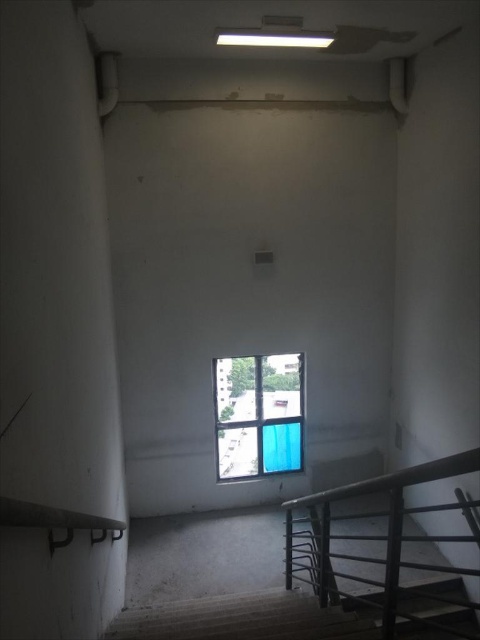
Question: Can you confirm if metallic gray balustrade at lower right is bigger than blue fabric curtain at center?

Choices:
 (A) yes
 (B) no

Answer: (A)

Question: Which object is farther from the camera taking this photo?

Choices:
 (A) blue fabric curtain at center
 (B) metallic gray balustrade at lower right

Answer: (A)

Question: Observing the image, what is the correct spatial positioning of smooth concrete stairs at lower right in reference to blue fabric curtain at center?

Choices:
 (A) below
 (B) above

Answer: (A)

Question: Which point appears farthest from the camera in this image?

Choices:
 (A) (428, 586)
 (B) (317, 515)
 (C) (255, 413)

Answer: (C)

Question: Which object is farther from the camera taking this photo?

Choices:
 (A) smooth concrete stairs at lower right
 (B) metallic gray balustrade at lower right

Answer: (A)

Question: Is the position of smooth concrete stairs at lower right more distant than that of blue fabric curtain at center?

Choices:
 (A) no
 (B) yes

Answer: (A)